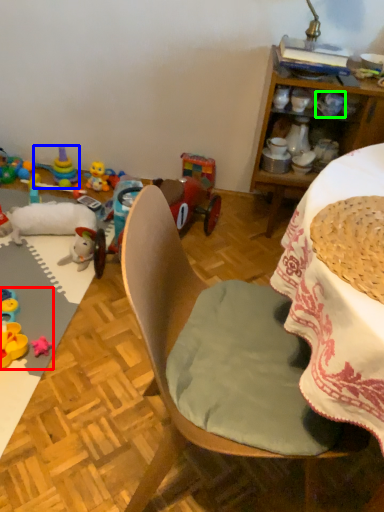
Question: Which is nearer to the toy (highlighted by a red box)? toy (highlighted by a blue box) or coffee cup (highlighted by a green box).

Choices:
 (A) toy
 (B) coffee cup

Answer: (A)